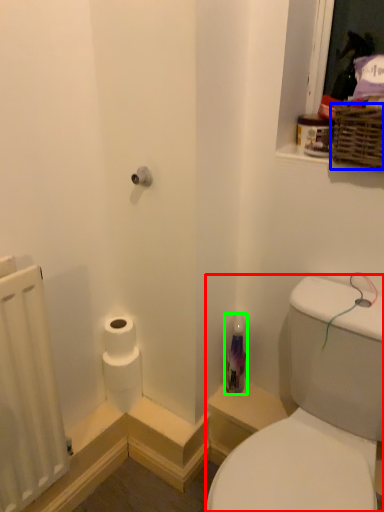
Question: Based on their relative distances, which object is nearer to sink (highlighted by a red box)? Choose from basket (highlighted by a blue box) and toiletry (highlighted by a green box).

Choices:
 (A) basket
 (B) toiletry

Answer: (B)